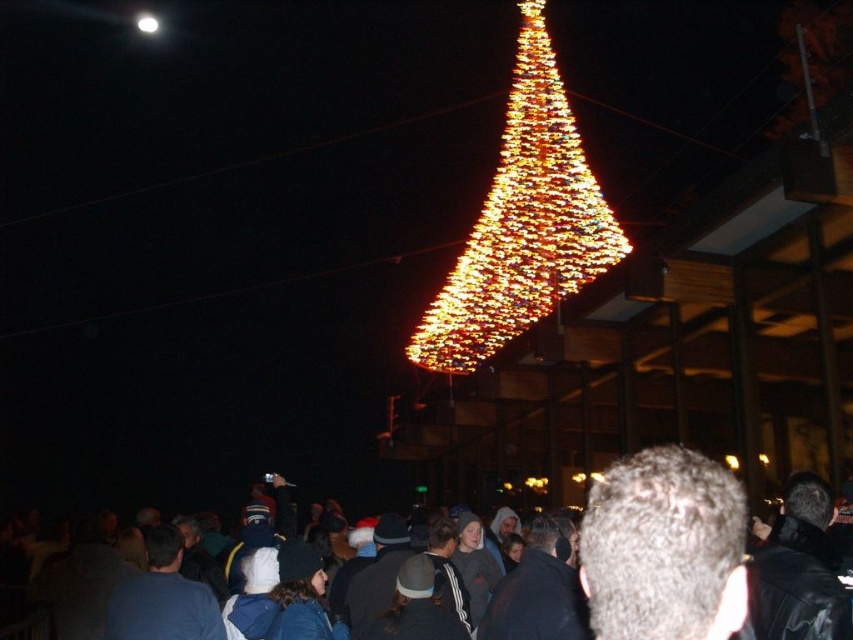
Does dark clothing crowd at center have a lesser width compared to gray hair at center?

In fact, dark clothing crowd at center might be wider than gray hair at center.

Is the position of dark clothing crowd at center less distant than that of gray hair at center?

That is False.

Does point (732, 506) lie behind point (604, 493)?

No, (732, 506) is closer to viewer.

Where is `dark clothing crowd at center`? The height and width of the screenshot is (640, 853). dark clothing crowd at center is located at coordinates (688, 557).

Can you confirm if dark clothing crowd at center is bigger than white glossy light at upper left?

Yes, dark clothing crowd at center is bigger than white glossy light at upper left.

Looking at this image, does dark clothing crowd at center lie behind white glossy light at upper left?

No, it is in front of white glossy light at upper left.

Is point (708, 481) closer to camera compared to point (158, 20)?

Yes, point (708, 481) is in front of point (158, 20).

The height and width of the screenshot is (640, 853). In order to click on dark clothing crowd at center in this screenshot , I will do `click(688, 557)`.

Is illuminated plastic christmas tree at center bigger than white glossy light at upper left?

Correct, illuminated plastic christmas tree at center is larger in size than white glossy light at upper left.

Which is behind, point (563, 166) or point (154, 17)?

Positioned behind is point (154, 17).

Locate an element on the screen. The image size is (853, 640). illuminated plastic christmas tree at center is located at coordinates pos(521,221).

Where is `illuminated plastic christmas tree at center`? The image size is (853, 640). illuminated plastic christmas tree at center is located at coordinates (521, 221).